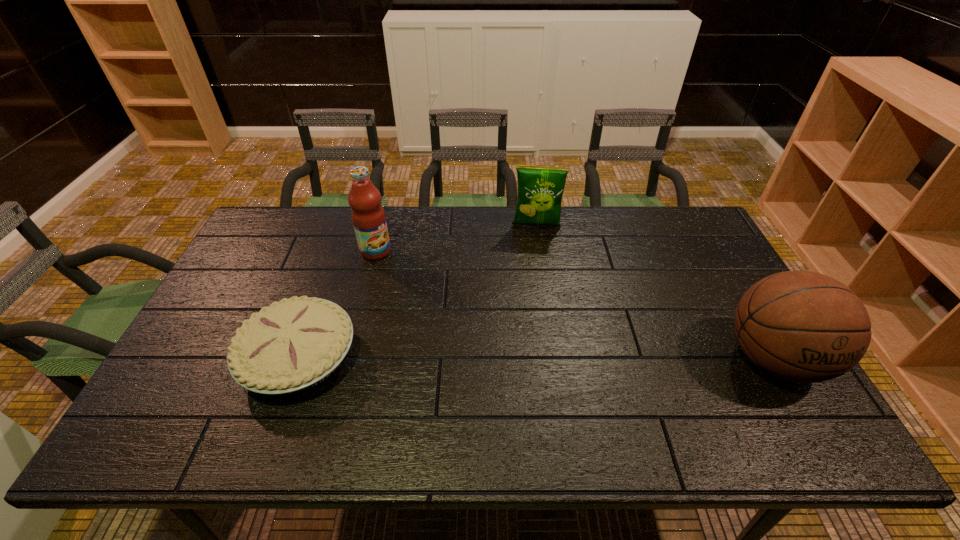
The image size is (960, 540). I want to click on free spot on the desktop that is between the shortest object and the rightmost object and is positioned on the front label of the second farthest object, so click(541, 358).

Identify the location of vacant space on the desktop that is between the shortest object and the rightmost object and is positioned on the front-facing side of the second object from right to left. (534, 357).